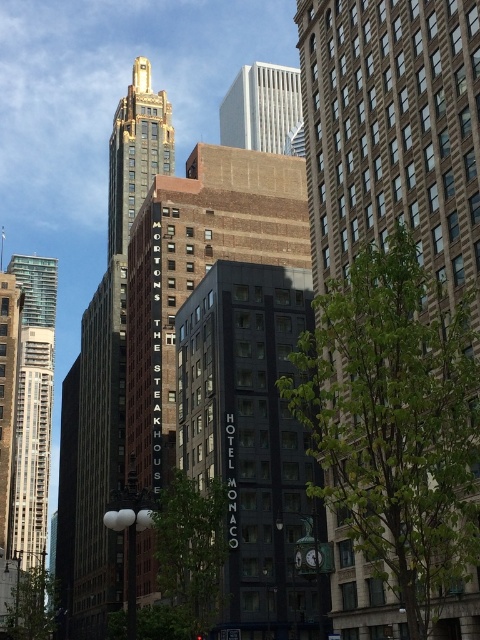
Question: Which is nearer to the brown brick building at center?

Choices:
 (A) black glass building at center
 (B) shiny gold tower at upper center

Answer: (A)

Question: Which object is the closest to the white marble skyscraper at upper center?

Choices:
 (A) brown brick building at center
 (B) shiny gold tower at upper center

Answer: (B)

Question: Does brown brick building at center have a lesser width compared to black glass building at center?

Choices:
 (A) yes
 (B) no

Answer: (A)

Question: Does black glass building at center appear on the left side of shiny gold tower at upper center?

Choices:
 (A) yes
 (B) no

Answer: (B)

Question: Is brown brick building at center thinner than white marble skyscraper at upper center?

Choices:
 (A) no
 (B) yes

Answer: (B)

Question: Which point is farther to the camera?

Choices:
 (A) white marble skyscraper at upper center
 (B) shiny gold tower at upper center
 (C) brown brick building at center
 (D) black glass building at center

Answer: (A)